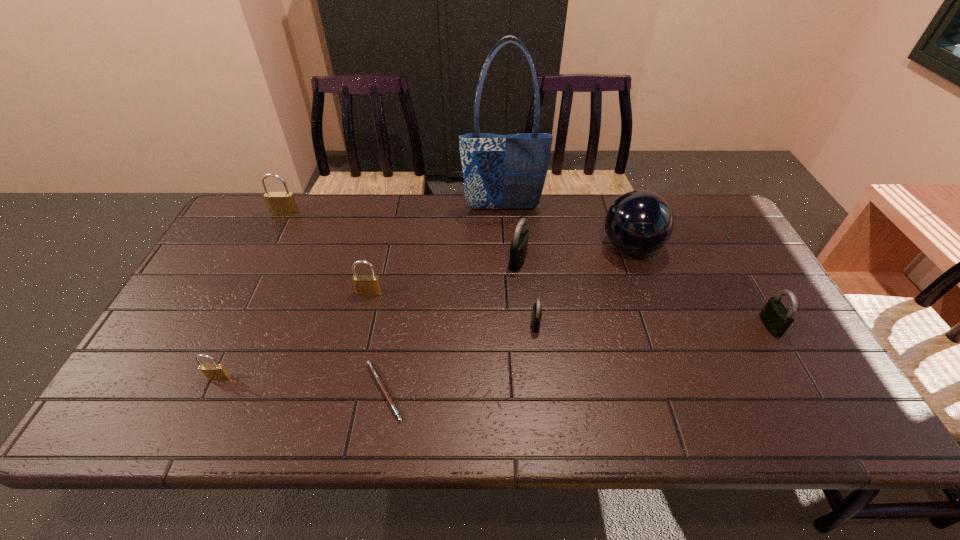
The image size is (960, 540). Find the location of `object that is at the right edge`. object that is at the right edge is located at coordinates (775, 317).

Find the location of `object that is at the far left corner`. object that is at the far left corner is located at coordinates (279, 203).

The image size is (960, 540). Identify the location of vacant area at the far edge. (576, 204).

Where is `vacant space at the near edge of the desktop`? vacant space at the near edge of the desktop is located at coordinates (449, 418).

Image resolution: width=960 pixels, height=540 pixels. In the image, there is a desktop. Identify the location of vacant space at the left edge. (219, 264).

In the image, there is a desktop. Where is `free region at the right edge`? free region at the right edge is located at coordinates (697, 245).

In the image, there is a desktop. At what (x,y) coordinates should I click in order to perform the action: click on vacant space at the far left corner. Please return your answer as a coordinate pair (x, y). Looking at the image, I should click on pos(242,207).

I want to click on blank space at the far right corner of the desktop, so click(732, 229).

Find the location of a particular element. Image resolution: width=960 pixels, height=540 pixels. unoccupied position between the rightmost brass padlock and the nearest brass padlock is located at coordinates (294, 335).

In order to click on vacant space that's between the sixth object from right to left and the tallest object in this screenshot , I will do `click(444, 300)`.